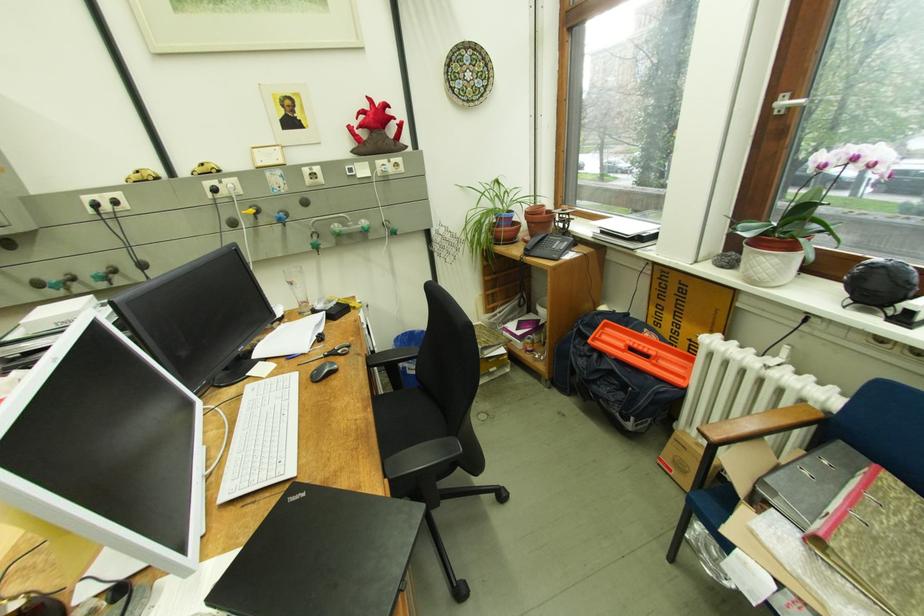
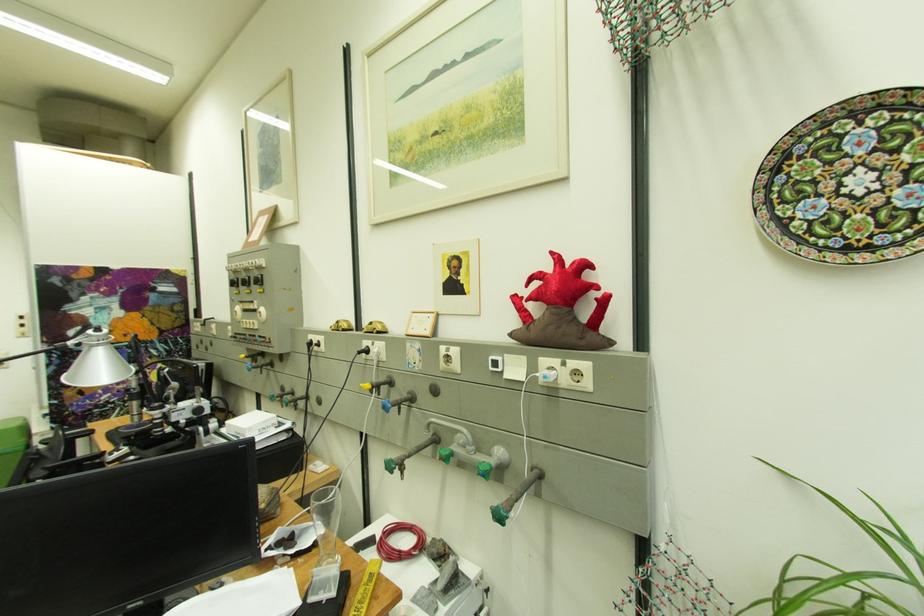
Where in the second image is the point corresponding to (x=92, y=198) from the first image?

(320, 336)